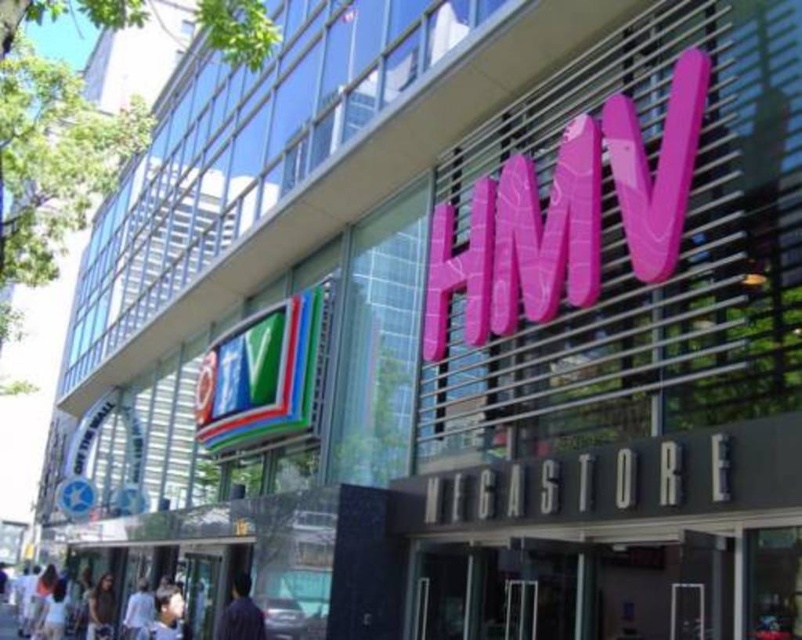
Based on the photo, you are standing in front of the HMV Megastore and see both the light blue shirt at lower left and the white fabric shirt at lower left. Which shirt is nearer to you?

The light blue shirt at lower left is closer to the viewer than the white fabric shirt at lower left, so the light blue shirt is nearer.

You are standing in front of the HMV Megastore building and notice two points marked on its facade. The first point is at coordinates point (164, 598) and the second is at point (96, 625). From your vantage point, which point appears closer to you?

Point (96, 625) appears closer because it is in front of point (164, 598) according to their spatial arrangement.

You are a customer entering the HMV Megastore and notice two items displayed on a rack at the entrance. The light blue shirt at lower left and the dark brown leather jacket at lower left are both on the same rack. Which item is positioned higher on the rack?

The light blue shirt at lower left is positioned higher on the rack than the dark brown leather jacket at lower left.